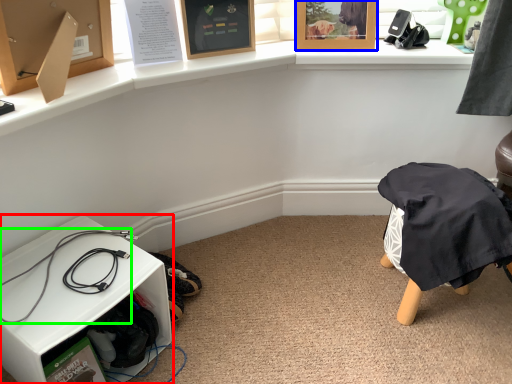
Question: Which is nearer to the furniture (highlighted by a red box)? picture frame (highlighted by a blue box) or wire (highlighted by a green box).

Choices:
 (A) picture frame
 (B) wire

Answer: (B)